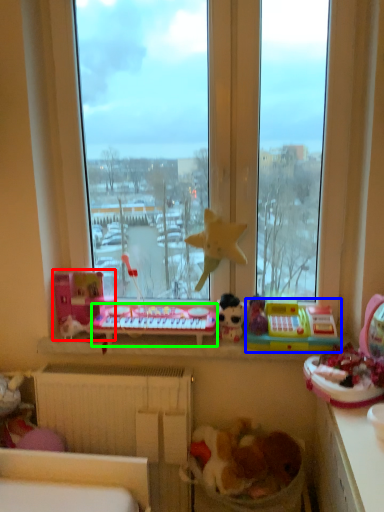
Question: Estimate the real-world distances between objects in this image. Which object is closer to toy (highlighted by a red box), toy (highlighted by a blue box) or changing table (highlighted by a green box)?

Choices:
 (A) toy
 (B) changing table

Answer: (B)